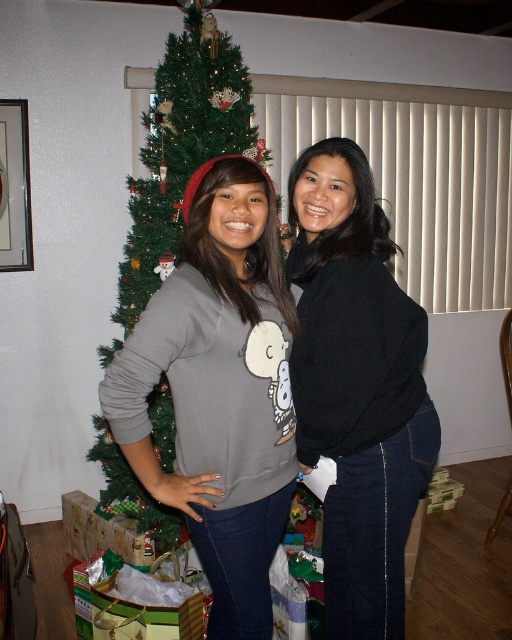
You are helping to decorate the living room for Christmas. You have a new ornament that needs to be placed on the green textured christmas tree at center. However, you notice the green shiny wrapping paper at lower left is in the way. Can you place the ornament on the tree without moving the wrapping paper?

The green textured christmas tree at center is located above the green shiny wrapping paper at lower left, so you can place the ornament on the tree without moving the wrapping paper since the tree is positioned higher up.

You are organizing a photo shoot and need to ensure that the black matte sweater at center and the green textured christmas tree at center are both visible in the frame. Given their sizes, which object will require more horizontal space in the photo to fully capture its details?

The green textured christmas tree at center requires more horizontal space because it has a greater width than the black matte sweater at center.